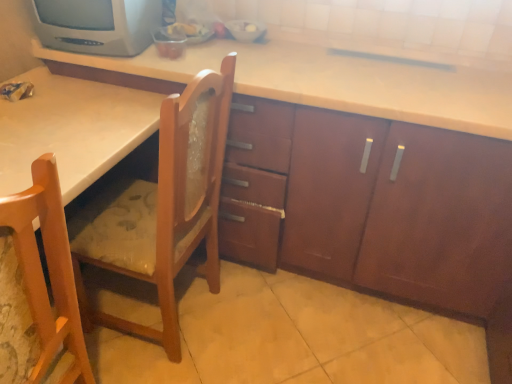
Question: Are light brown wood chair at lower left, acting as the 1th chair starting from the front, and matte gray crt tv at upper left beside each other?

Choices:
 (A) yes
 (B) no

Answer: (B)

Question: Is light brown wood chair at lower left, which is the 2th chair from back to front, bigger than matte gray crt tv at upper left?

Choices:
 (A) yes
 (B) no

Answer: (A)

Question: Can you confirm if light brown wood chair at lower left, which is the 2th chair from back to front, is positioned to the left of matte gray crt tv at upper left?

Choices:
 (A) no
 (B) yes

Answer: (B)

Question: Is light brown wood chair at lower left, which is the 2th chair from back to front, positioned beyond the bounds of matte gray crt tv at upper left?

Choices:
 (A) no
 (B) yes

Answer: (B)

Question: Is matte gray crt tv at upper left inside light brown wood chair at lower left, which is the 2th chair from back to front?

Choices:
 (A) no
 (B) yes

Answer: (A)

Question: Is wooden chair at center, acting as the 2th chair starting from the front, to the left or to the right of matte gray crt tv at upper left in the image?

Choices:
 (A) left
 (B) right

Answer: (B)

Question: In the image, is wooden chair at center, acting as the 2th chair starting from the front, positioned in front of or behind matte gray crt tv at upper left?

Choices:
 (A) front
 (B) behind

Answer: (A)

Question: Considering the positions of wooden chair at center, acting as the 2th chair starting from the front, and matte gray crt tv at upper left in the image, is wooden chair at center, acting as the 2th chair starting from the front, taller or shorter than matte gray crt tv at upper left?

Choices:
 (A) tall
 (B) short

Answer: (A)

Question: In terms of size, does wooden chair at center, which is the first chair from back to front, appear bigger or smaller than matte gray crt tv at upper left?

Choices:
 (A) big
 (B) small

Answer: (A)

Question: Based on their positions, is matte gray crt tv at upper left located to the left or right of light brown wood chair at lower left, acting as the 1th chair starting from the front?

Choices:
 (A) right
 (B) left

Answer: (A)

Question: Considering the positions of matte gray crt tv at upper left and light brown wood chair at lower left, which is the 2th chair from back to front, in the image, is matte gray crt tv at upper left bigger or smaller than light brown wood chair at lower left, which is the 2th chair from back to front,?

Choices:
 (A) big
 (B) small

Answer: (B)

Question: From a real-world perspective, is matte gray crt tv at upper left above or below light brown wood chair at lower left, which is the 2th chair from back to front?

Choices:
 (A) below
 (B) above

Answer: (B)

Question: Considering the positions of matte gray crt tv at upper left and light brown wood chair at lower left, acting as the 1th chair starting from the front, in the image, is matte gray crt tv at upper left wider or thinner than light brown wood chair at lower left, acting as the 1th chair starting from the front,?

Choices:
 (A) wide
 (B) thin

Answer: (B)

Question: Relative to wooden chair at center, acting as the 2th chair starting from the front, is light brown wood chair at lower left, acting as the 1th chair starting from the front, in front or behind?

Choices:
 (A) behind
 (B) front

Answer: (B)

Question: Looking at the image, does light brown wood chair at lower left, which is the 2th chair from back to front, seem bigger or smaller compared to wooden chair at center, acting as the 2th chair starting from the front?

Choices:
 (A) big
 (B) small

Answer: (B)